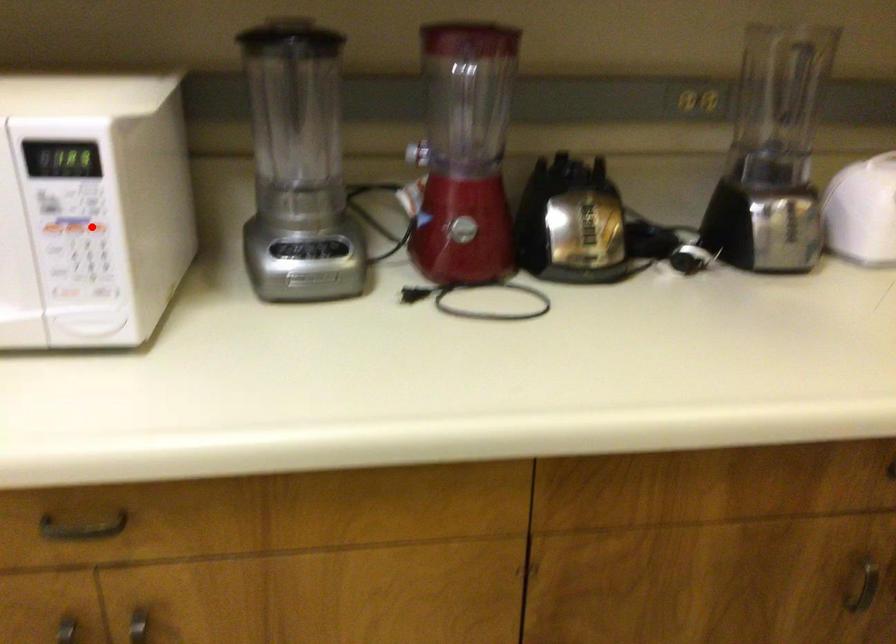
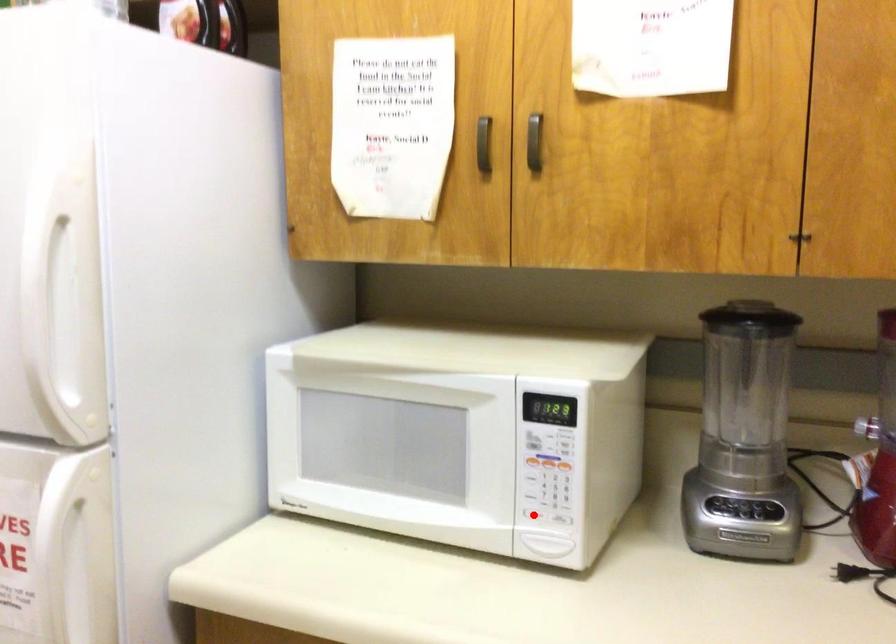
I am providing you with two images of the same scene from different viewpoints. A red point is marked on the first image and another point is marked on the second image. Is the red point in image1 aligned with the point shown in image2?

No